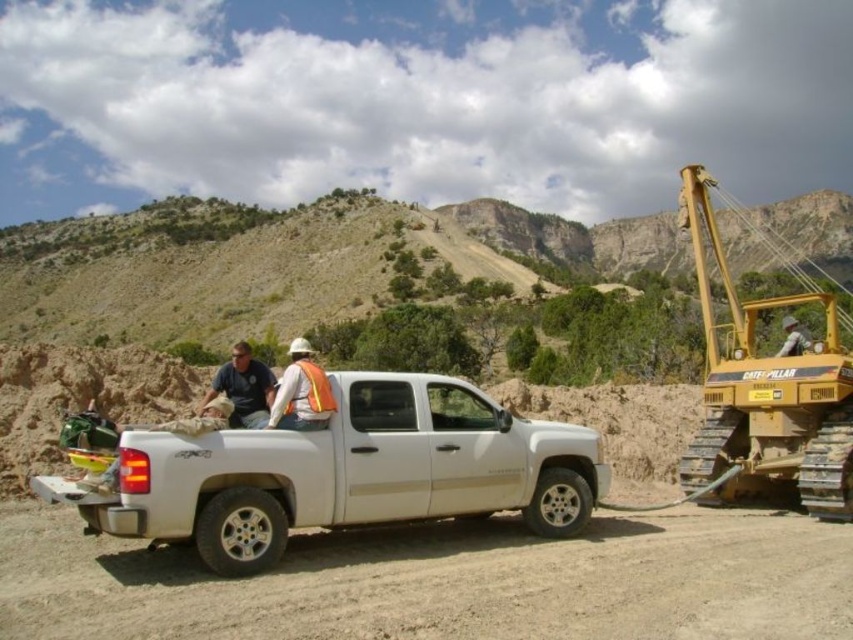
Who is more forward, [314,381] or [311,371]?

Positioned in front is point [314,381].

Does orange reflective vest at center have a lesser width compared to hi-visibility fabric safety vest at center?

Incorrect, orange reflective vest at center's width is not less than hi-visibility fabric safety vest at center's.

The width and height of the screenshot is (853, 640). What are the coordinates of `orange reflective vest at center` in the screenshot? It's located at (300, 392).

Looking at this image, who is positioned more to the left, brown sandy dirt track at lower center or yellow metallic excavator at right?

Positioned to the left is brown sandy dirt track at lower center.

Which is behind, point (469, 627) or point (820, 428)?

The point (820, 428) is more distant.

This screenshot has width=853, height=640. In order to click on brown sandy dirt track at lower center in this screenshot , I will do `click(444, 580)`.

Can you confirm if brown sandy dirt track at lower center is positioned to the left of hi-visibility fabric safety vest at center?

No, brown sandy dirt track at lower center is not to the left of hi-visibility fabric safety vest at center.

Does brown sandy dirt track at lower center have a lesser width compared to hi-visibility fabric safety vest at center?

In fact, brown sandy dirt track at lower center might be wider than hi-visibility fabric safety vest at center.

Between point (602, 544) and point (308, 396), which one is positioned behind?

Point (602, 544)

The height and width of the screenshot is (640, 853). Find the location of `brown sandy dirt track at lower center`. brown sandy dirt track at lower center is located at coordinates (444, 580).